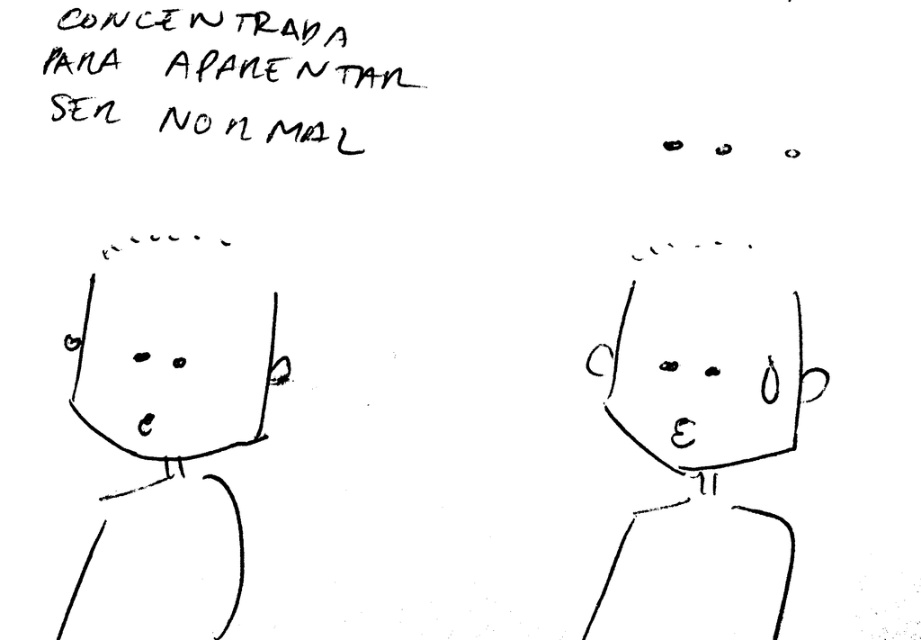
Question: Can you confirm if black line drawing face at left is positioned above smooth black face at center?

Choices:
 (A) yes
 (B) no

Answer: (A)

Question: Can you confirm if black line drawing face at left is thinner than smooth black face at center?

Choices:
 (A) yes
 (B) no

Answer: (A)

Question: Which object is closer to the camera taking this photo?

Choices:
 (A) smooth black face at center
 (B) black line drawing face at left

Answer: (B)

Question: Is black line drawing face at left closer to the viewer compared to smooth black face at center?

Choices:
 (A) yes
 (B) no

Answer: (A)